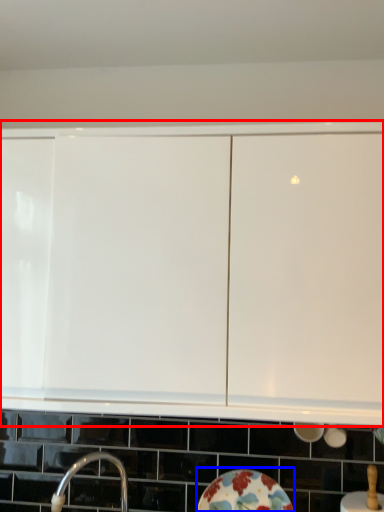
Question: Among these objects, which one is nearest to the camera, cabinetry (highlighted by a red box) or plate (highlighted by a blue box)?

Choices:
 (A) cabinetry
 (B) plate

Answer: (A)